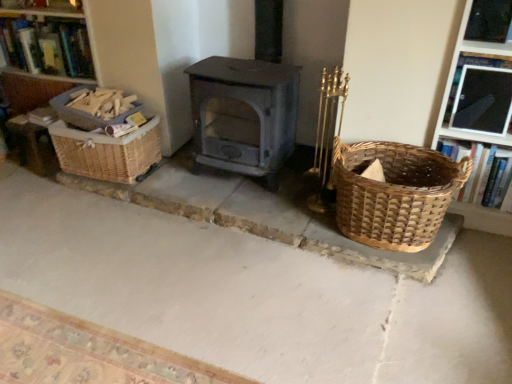
Question: Is woven wood basket at left, placed as the 1th basket when sorted from left to right, behind hardcover book at upper left, which is counted as the first book, starting from the top?

Choices:
 (A) no
 (B) yes

Answer: (A)

Question: Does woven wood basket at left, placed as the 1th basket when sorted from left to right, have a lesser height compared to hardcover book at upper left, the 1th book viewed from the left?

Choices:
 (A) yes
 (B) no

Answer: (A)

Question: Is hardcover book at upper left, the 1th book viewed from the left, a part of woven wood basket at left, which is the third basket in right-to-left order?

Choices:
 (A) no
 (B) yes

Answer: (A)

Question: Considering the relative sizes of woven wood basket at left, which is the third basket in right-to-left order, and hardcover book at upper left, arranged as the second book when ordered from the bottom, in the image provided, is woven wood basket at left, which is the third basket in right-to-left order, taller than hardcover book at upper left, arranged as the second book when ordered from the bottom,?

Choices:
 (A) no
 (B) yes

Answer: (A)

Question: From the image's perspective, would you say woven wood basket at left, which is the third basket in right-to-left order, is shown under hardcover book at upper left, arranged as the second book when ordered from the bottom?

Choices:
 (A) no
 (B) yes

Answer: (B)

Question: From the image's perspective, would you say woven wood basket at left, placed as the 1th basket when sorted from left to right, is positioned over hardcover book at upper left, arranged as the second book when ordered from the bottom?

Choices:
 (A) no
 (B) yes

Answer: (A)

Question: Is hardcover book at upper left, which is counted as the first book, starting from the top, positioned in front of woven wood basket at left, placed as the 1th basket when sorted from left to right?

Choices:
 (A) yes
 (B) no

Answer: (B)

Question: Considering the relative sizes of hardcover book at upper left, which is counted as the 1th book, starting from the back, and woven wood basket at left, which is the third basket in right-to-left order, in the image provided, is hardcover book at upper left, which is counted as the 1th book, starting from the back, shorter than woven wood basket at left, which is the third basket in right-to-left order,?

Choices:
 (A) yes
 (B) no

Answer: (B)

Question: Can you confirm if hardcover book at upper left, which is counted as the first book, starting from the top, is bigger than woven wood basket at left, which is the third basket in right-to-left order?

Choices:
 (A) no
 (B) yes

Answer: (B)

Question: Considering the relative sizes of hardcover book at upper left, arranged as the second book when ordered from the bottom, and woven wood basket at left, placed as the 1th basket when sorted from left to right, in the image provided, is hardcover book at upper left, arranged as the second book when ordered from the bottom, taller than woven wood basket at left, placed as the 1th basket when sorted from left to right,?

Choices:
 (A) no
 (B) yes

Answer: (B)

Question: Is hardcover book at upper left, arranged as the 2th book when viewed from the right, outside woven wood basket at left, placed as the 1th basket when sorted from left to right?

Choices:
 (A) yes
 (B) no

Answer: (A)

Question: From a real-world perspective, is hardcover book at upper left, the 1th book viewed from the left, on top of woven wood basket at left, which is the third basket in right-to-left order?

Choices:
 (A) no
 (B) yes

Answer: (B)

Question: Is woven brown basket at left, which appears as the second basket when viewed from the left, inside natural stone basket at lower right?

Choices:
 (A) yes
 (B) no

Answer: (B)